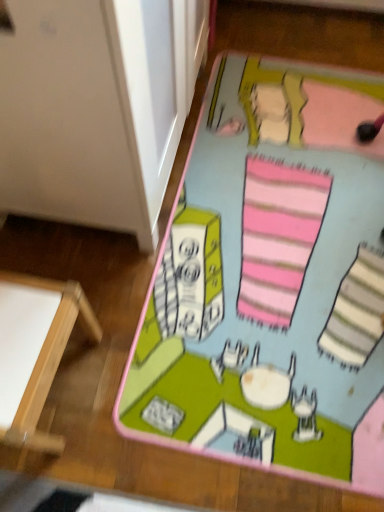
Question: Should I look upward or downward to see white wood table at lower left?

Choices:
 (A) up
 (B) down

Answer: (B)